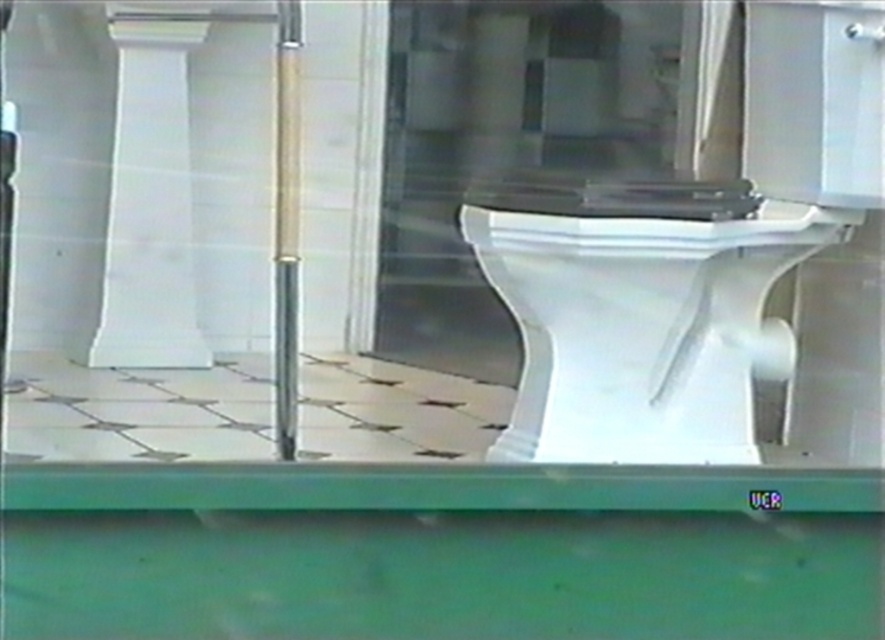
You are a contractor measuring the bathroom layout. You need to install a new shower curtain rod that requires at least 1 meter of space between the transparent glass door at center and the white glossy pillar at upper left. Can the space accommodate it based on their widths?

The transparent glass door at center is wider than the white glossy pillar at upper left. However, the description only provides information about their widths relative to each other, not their exact measurements. Without knowing the actual width of the transparent glass door at center, it is impossible to determine if the space between them meets the 1 meter requirement.

You are standing in the bathroom and want to move from the white glossy pillar at upper left to the white glossy toilet bowl at center. Which direction should you move relative to the pillar?

You should move to the right of the white glossy pillar at upper left to reach the white glossy toilet bowl at center since the toilet bowl is positioned to the right of the pillar.